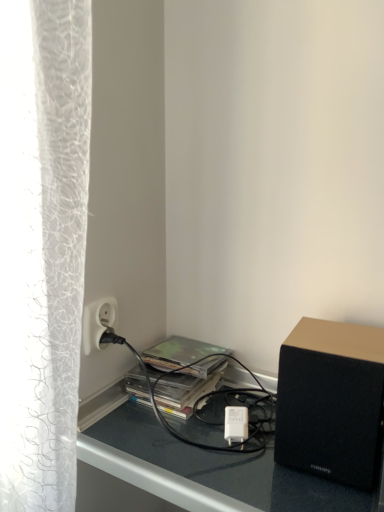
The height and width of the screenshot is (512, 384). What do you see at coordinates (98, 322) in the screenshot?
I see `white plastic power outlet at lower left` at bounding box center [98, 322].

Locate an element on the screen. white plastic power outlet at lower left is located at coordinates (98, 322).

Does black matte speaker at lower right touch camouflage paper at center?

They are not placed beside each other.

Where is `loudspeaker on the right of camouflage paper at center`? The image size is (384, 512). loudspeaker on the right of camouflage paper at center is located at coordinates point(331,401).

From the image's perspective, is black matte speaker at lower right under camouflage paper at center?

Correct, black matte speaker at lower right appears lower than camouflage paper at center in the image.

Is black matte speaker at lower right outside of camouflage paper at center?

Yes.

Considering the relative sizes of camouflage paper at center and black matte speaker at lower right in the image provided, is camouflage paper at center shorter than black matte speaker at lower right?

Indeed, camouflage paper at center has a lesser height compared to black matte speaker at lower right.

How much distance is there between camouflage paper at center and black matte speaker at lower right?

They are 10.40 inches apart.

Is camouflage paper at center looking in the opposite direction of black matte speaker at lower right?

No.

Is camouflage paper at center to the left of black matte speaker at lower right from the viewer's perspective?

Yes.

Is point (84, 351) closer or farther from the camera than point (208, 358)?

Point (84, 351) is closer to the camera than point (208, 358).

From the picture: Is white plastic power outlet at lower left placed right next to camouflage paper at center?

No, white plastic power outlet at lower left is not with camouflage paper at center.

From the image's perspective, relative to camouflage paper at center, is white plastic power outlet at lower left above or below?

white plastic power outlet at lower left is above camouflage paper at center.

Does white plastic power outlet at lower left have a larger size compared to camouflage paper at center?

No, white plastic power outlet at lower left is not bigger than camouflage paper at center.

Between camouflage paper at center and white plastic power outlet at lower left, which one has smaller size?

white plastic power outlet at lower left is smaller.

In the scene shown: Could you tell me if camouflage paper at center is turned towards white plastic power outlet at lower left?

No, camouflage paper at center does not turn towards white plastic power outlet at lower left.

Is camouflage paper at center positioned before white plastic power outlet at lower left?

No, the depth of camouflage paper at center is greater than that of white plastic power outlet at lower left.

Based on the photo, in terms of height, does camouflage paper at center look taller or shorter compared to white plastic power outlet at lower left?

camouflage paper at center is shorter than white plastic power outlet at lower left.

From the image's perspective, which object appears higher, white plastic power outlet at lower left or black matte speaker at lower right?

white plastic power outlet at lower left, from the image's perspective.

Consider the image. Is white plastic power outlet at lower left not close to black matte speaker at lower right?

No, there isn't a large distance between white plastic power outlet at lower left and black matte speaker at lower right.

Considering the positions of point (88, 336) and point (286, 460), is point (88, 336) closer or farther from the camera than point (286, 460)?

Clearly, point (88, 336) is more distant from the camera than point (286, 460).

Considering the sizes of objects white plastic power outlet at lower left and black matte speaker at lower right in the image provided, who is thinner, white plastic power outlet at lower left or black matte speaker at lower right?

white plastic power outlet at lower left is thinner.

Considering the relative sizes of black matte speaker at lower right and white plastic power outlet at lower left in the image provided, is black matte speaker at lower right shorter than white plastic power outlet at lower left?

Incorrect, the height of black matte speaker at lower right does not fall short of that of white plastic power outlet at lower left.

Does black matte speaker at lower right appear on the right side of white plastic power outlet at lower left?

Indeed, black matte speaker at lower right is positioned on the right side of white plastic power outlet at lower left.

From the image's perspective, does black matte speaker at lower right appear lower than white plastic power outlet at lower left?

Yes, from the image's perspective, black matte speaker at lower right is below white plastic power outlet at lower left.

This screenshot has width=384, height=512. I want to click on paperback book behind the black matte speaker at lower right, so pos(185,356).

There is a camouflage paper at center. Identify the location of loudspeaker above it (from a real-world perspective). (331, 401).

Which object lies further to the anchor point white plastic power outlet at lower left, black matte speaker at lower right or camouflage paper at center?

Among the two, black matte speaker at lower right is located further to white plastic power outlet at lower left.

Based on their spatial positions, is white plastic power outlet at lower left or camouflage paper at center closer to black matte speaker at lower right?

camouflage paper at center is positioned closer to the anchor black matte speaker at lower right.

Estimate the real-world distances between objects in this image. Which object is further from black matte speaker at lower right, camouflage paper at center or white plastic power outlet at lower left?

Based on the image, white plastic power outlet at lower left appears to be further to black matte speaker at lower right.

Considering their positions, is black matte speaker at lower right positioned further to camouflage paper at center than white plastic power outlet at lower left?

Among the two, black matte speaker at lower right is located further to camouflage paper at center.

Based on their spatial positions, is camouflage paper at center or black matte speaker at lower right further from white plastic power outlet at lower left?

The object further to white plastic power outlet at lower left is black matte speaker at lower right.

Considering their positions, is white plastic power outlet at lower left positioned further to camouflage paper at center than black matte speaker at lower right?

black matte speaker at lower right is further to camouflage paper at center.

Locate an element on the screen. paperback book located between white plastic power outlet at lower left and black matte speaker at lower right in the left-right direction is located at coordinates coord(185,356).